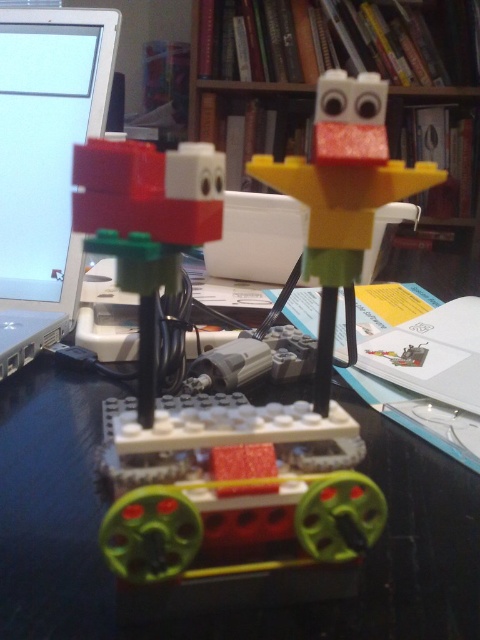
You are a small toy car that is 3 inches long. You want to move from the green plastic table at center to the yellow matte plastic bird at upper center. Can you fit through the space between them?

The distance between the green plastic table at center and the yellow matte plastic bird at upper center is 5.09 inches. Since the toy car is 3 inches long, it can easily fit through the space between them as there is enough clearance.

What is located at the coordinates point (418, 93)?

The wooden bookshelf at upper center is located at point (418, 93).

You are organizing a desk and want to place both the wooden bookshelf at upper center and the yellow matte plastic bird at upper center. Since both are at the upper center, which one should you place first to ensure they both fit?

Answer: The wooden bookshelf at upper center is wider than the yellow matte plastic bird at upper center, so place the wooden bookshelf at upper center first to accommodate its greater width.